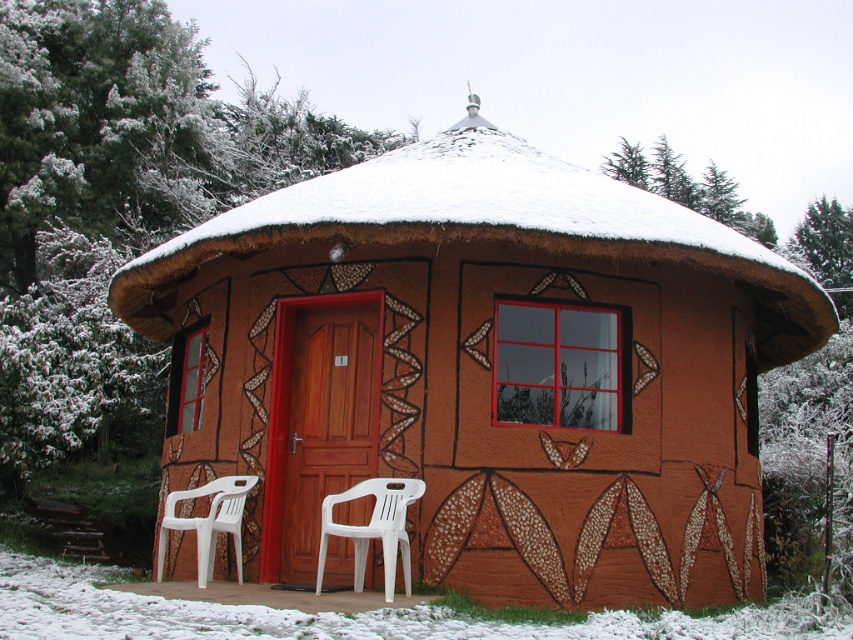
In the scene shown: Is white plastic chair at front shorter than white plastic chair at lower left?

Correct, white plastic chair at front is not as tall as white plastic chair at lower left.

Who is more forward, (317, 566) or (210, 529)?

Positioned in front is point (317, 566).

Locate an element on the screen. white plastic chair at front is located at coordinates (373, 529).

Is brown textured hut at center thinner than white plastic chair at front?

In fact, brown textured hut at center might be wider than white plastic chair at front.

Does brown textured hut at center have a greater height compared to white plastic chair at front?

Yes.

Is point (206, 376) positioned in front of point (357, 497)?

No, it is not.

I want to click on brown textured hut at center, so click(x=483, y=371).

Which is behind, point (451, 403) or point (225, 508)?

The point (225, 508) is behind.

Between brown textured hut at center and white plastic chair at lower left, which one appears on the right side from the viewer's perspective?

From the viewer's perspective, brown textured hut at center appears more on the right side.

This screenshot has width=853, height=640. Identify the location of brown textured hut at center. (483, 371).

Locate an element on the screen. brown textured hut at center is located at coordinates (483, 371).